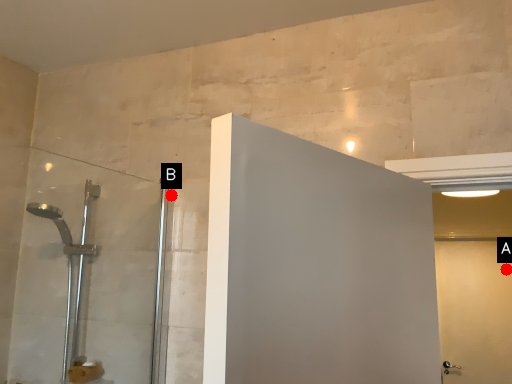
Question: Two points are circled on the image, labeled by A and B beside each circle. Which point is closer to the camera taking this photo?

Choices:
 (A) A is closer
 (B) B is closer

Answer: (B)